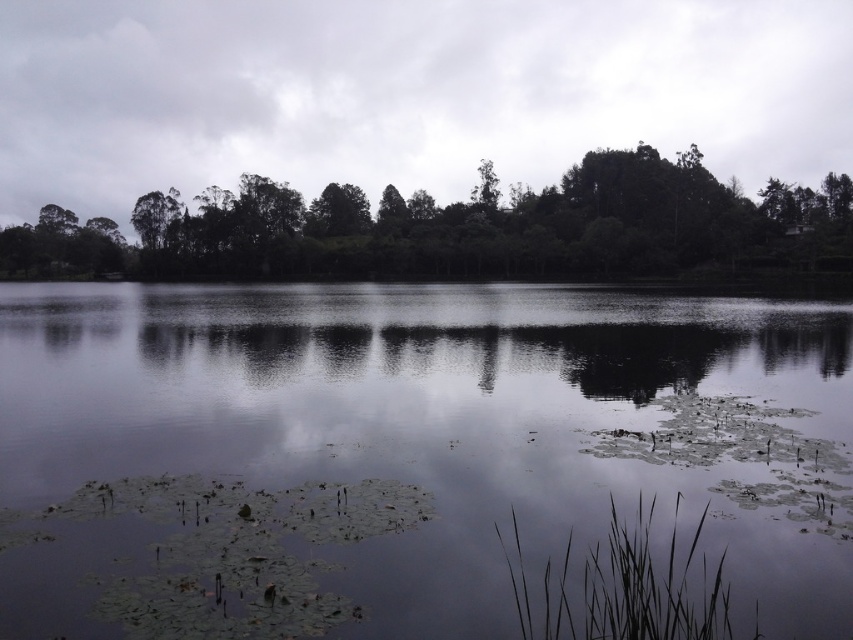
Is the position of transparent water at center more distant than that of green leafy trees at upper center?

No, transparent water at center is closer to the viewer.

Between transparent water at center and green leafy trees at upper center, which one appears on the left side from the viewer's perspective?

green leafy trees at upper center is more to the left.

This screenshot has height=640, width=853. I want to click on transparent water at center, so click(x=397, y=408).

Where is `transparent water at center`? This screenshot has width=853, height=640. transparent water at center is located at coordinates (397, 408).